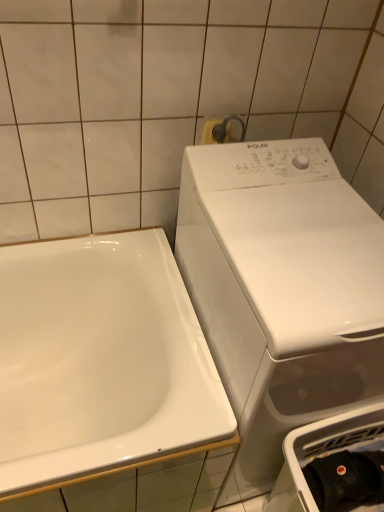
Question: Does black cotton cap at lower right appear on the right side of metallic silver towel bar at upper center?

Choices:
 (A) no
 (B) yes

Answer: (B)

Question: Does black cotton cap at lower right have a lesser width compared to metallic silver towel bar at upper center?

Choices:
 (A) yes
 (B) no

Answer: (B)

Question: Is black cotton cap at lower right oriented away from metallic silver towel bar at upper center?

Choices:
 (A) yes
 (B) no

Answer: (B)

Question: From the image's perspective, is black cotton cap at lower right located beneath metallic silver towel bar at upper center?

Choices:
 (A) no
 (B) yes

Answer: (B)

Question: Is black cotton cap at lower right smaller than metallic silver towel bar at upper center?

Choices:
 (A) yes
 (B) no

Answer: (B)

Question: Does black cotton cap at lower right appear on the left side of metallic silver towel bar at upper center?

Choices:
 (A) yes
 (B) no

Answer: (B)

Question: Is white glossy sink at left behind black cotton cap at lower right?

Choices:
 (A) no
 (B) yes

Answer: (A)

Question: Is white glossy sink at left bigger than black cotton cap at lower right?

Choices:
 (A) no
 (B) yes

Answer: (B)

Question: From a real-world perspective, is white glossy sink at left positioned under black cotton cap at lower right based on gravity?

Choices:
 (A) no
 (B) yes

Answer: (B)

Question: Is white glossy sink at left beside black cotton cap at lower right?

Choices:
 (A) yes
 (B) no

Answer: (B)

Question: Would you say white glossy sink at left contains black cotton cap at lower right?

Choices:
 (A) no
 (B) yes

Answer: (A)

Question: Can you confirm if white glossy sink at left is taller than black cotton cap at lower right?

Choices:
 (A) yes
 (B) no

Answer: (A)

Question: Is white glossy washing machine at right surrounded by white plastic dish washer at lower right?

Choices:
 (A) no
 (B) yes

Answer: (A)